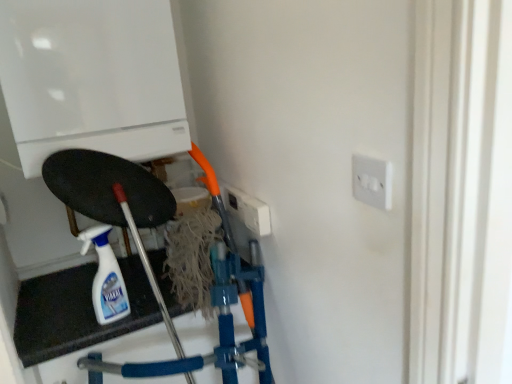
Question: From the image's perspective, is white glossy boiler at upper left over white glossy spray bottle at lower left?

Choices:
 (A) no
 (B) yes

Answer: (B)

Question: From the image's perspective, is white glossy boiler at upper left beneath white glossy spray bottle at lower left?

Choices:
 (A) no
 (B) yes

Answer: (A)

Question: From a real-world perspective, is white glossy boiler at upper left beneath white glossy spray bottle at lower left?

Choices:
 (A) yes
 (B) no

Answer: (B)

Question: Is white glossy boiler at upper left to the left of white glossy spray bottle at lower left from the viewer's perspective?

Choices:
 (A) yes
 (B) no

Answer: (A)

Question: Can you confirm if white glossy boiler at upper left is taller than white glossy spray bottle at lower left?

Choices:
 (A) no
 (B) yes

Answer: (B)

Question: Can you confirm if white glossy boiler at upper left is positioned to the right of white glossy spray bottle at lower left?

Choices:
 (A) yes
 (B) no

Answer: (B)

Question: Is white glossy spray bottle at lower left thinner than white glossy boiler at upper left?

Choices:
 (A) yes
 (B) no

Answer: (A)

Question: Considering the relative positions of white glossy spray bottle at lower left and white glossy boiler at upper left in the image provided, is white glossy spray bottle at lower left to the right of white glossy boiler at upper left from the viewer's perspective?

Choices:
 (A) no
 (B) yes

Answer: (B)

Question: Does white glossy spray bottle at lower left come in front of white glossy boiler at upper left?

Choices:
 (A) no
 (B) yes

Answer: (A)

Question: Does white glossy spray bottle at lower left have a larger size compared to white glossy boiler at upper left?

Choices:
 (A) yes
 (B) no

Answer: (B)

Question: From the image's perspective, is white glossy spray bottle at lower left on white glossy boiler at upper left?

Choices:
 (A) yes
 (B) no

Answer: (B)

Question: Can you confirm if white glossy spray bottle at lower left is wider than white glossy boiler at upper left?

Choices:
 (A) yes
 (B) no

Answer: (B)

Question: From a real-world perspective, is white plastic socket at upper right on white glossy boiler at upper left?

Choices:
 (A) no
 (B) yes

Answer: (A)